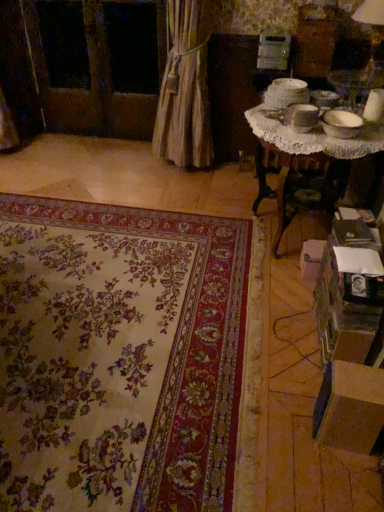
Question: From the image's perspective, is transparent glass window at upper left located above or below matte white table lamp at upper right?

Choices:
 (A) below
 (B) above

Answer: (B)

Question: From a real-world perspective, is transparent glass window at upper left physically located above or below matte white table lamp at upper right?

Choices:
 (A) below
 (B) above

Answer: (A)

Question: Considering the real-world distances, which object is closest to the matte white table lamp at upper right?

Choices:
 (A) white lace table at upper right
 (B) beige fabric curtain at left
 (C) brown cardboard box at lower right, the 2th cardboard box viewed from the back
 (D) white cardboard box at lower right, the 2th cardboard box when ordered from bottom to top
 (E) floral carpet at center

Answer: (A)

Question: Which object is positioned farthest from the white lace table at upper right?

Choices:
 (A) brown cardboard box at lower right, the 1th cardboard box from the bottom
 (B) matte white table lamp at upper right
 (C) beige fabric curtain at left
 (D) white cardboard box at lower right, which is the second cardboard box from front to back
 (E) floral carpet at center

Answer: (A)